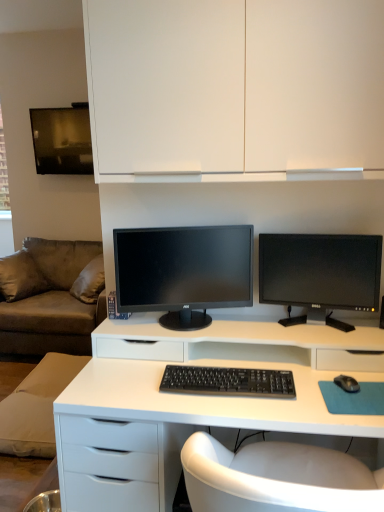
Locate an element on the screen. Image resolution: width=384 pixels, height=512 pixels. blank space situated above black plastic keyboard at center (from a real-world perspective) is located at coordinates (240, 374).